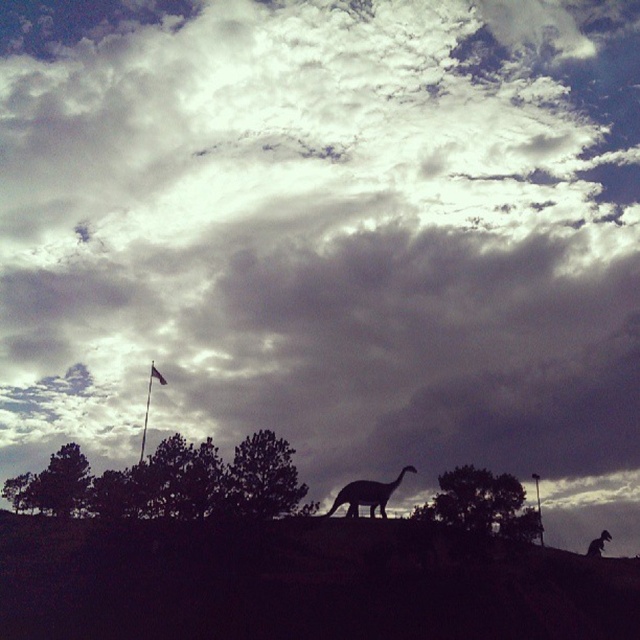
Based on the photo, you are a park ranger who needs to place a 30 meter long safety rope between the silhouette rock at center and the green leafy tree at lower left. Based on the scene, will the rope reach both points without needing to be extended?

The silhouette rock at center and green leafy tree at lower left are 29.50 meters apart. Since the rope is 30 meters long, it will be sufficient to reach both points without needing extension.

From the picture: You are standing in front of a large outdoor dinosaur exhibit. You notice two points marked on the ground at coordinates point (451,492) and point (275,483). If you want to touch the closest point to you, which coordinate should you walk towards?

Point (451,492) is closer to the viewer than point (275,483), so you should walk towards point (451,492) to touch the closest one.